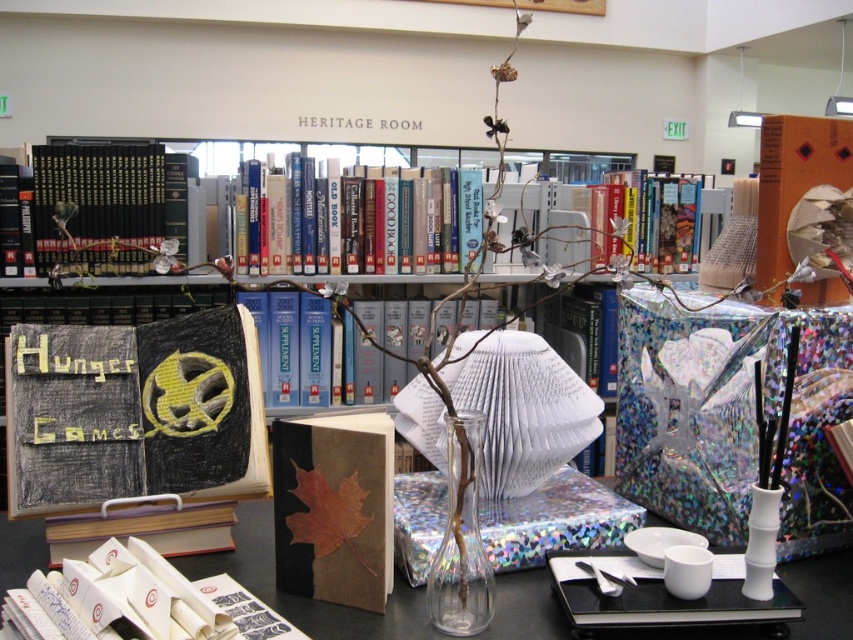
Can you confirm if black chalkboard book at center is taller than brown paper book at center?

Yes, black chalkboard book at center is taller than brown paper book at center.

Is black chalkboard book at center smaller than brown paper book at center?

Incorrect, black chalkboard book at center is not smaller in size than brown paper book at center.

Is point (161, 330) positioned in front of point (152, 624)?

No, it is behind (152, 624).

Locate an element on the screen. The height and width of the screenshot is (640, 853). black chalkboard book at center is located at coordinates (134, 412).

Looking at this image, which of these two, hardcover books at upper left or hardcover book at center, stands taller?

With more height is hardcover books at upper left.

Is point (175, 182) positioned in front of point (618, 205)?

Yes, point (175, 182) is closer to viewer.

The height and width of the screenshot is (640, 853). Identify the location of hardcover books at upper left. (105, 209).

Is brown matte book at center taller than hardcover book at center?

No.

Does brown matte book at center have a lesser height compared to hardcover book at center?

Yes.

Which is behind, point (374, 483) or point (592, 216)?

The point (592, 216) is behind.

Locate an element on the screen. brown matte book at center is located at coordinates (334, 508).